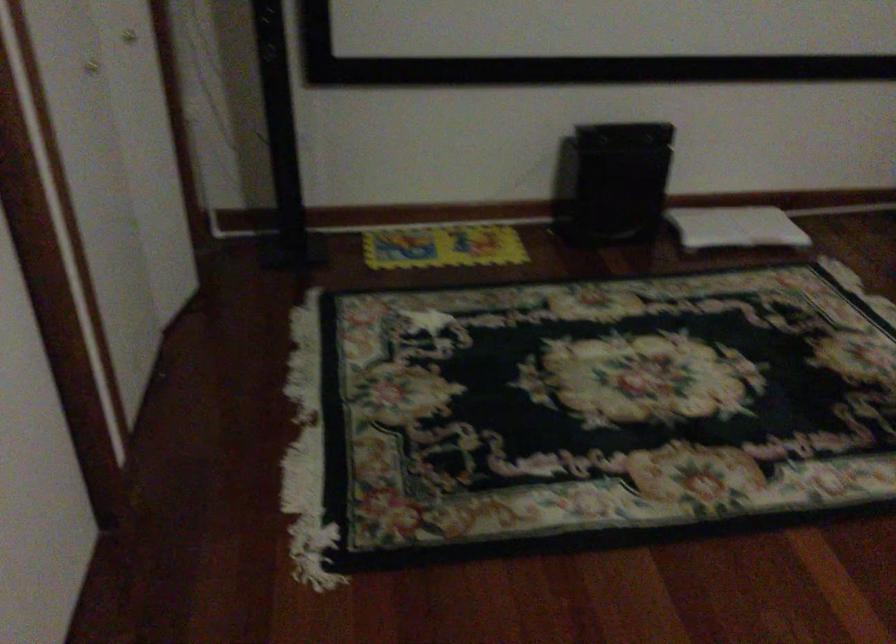
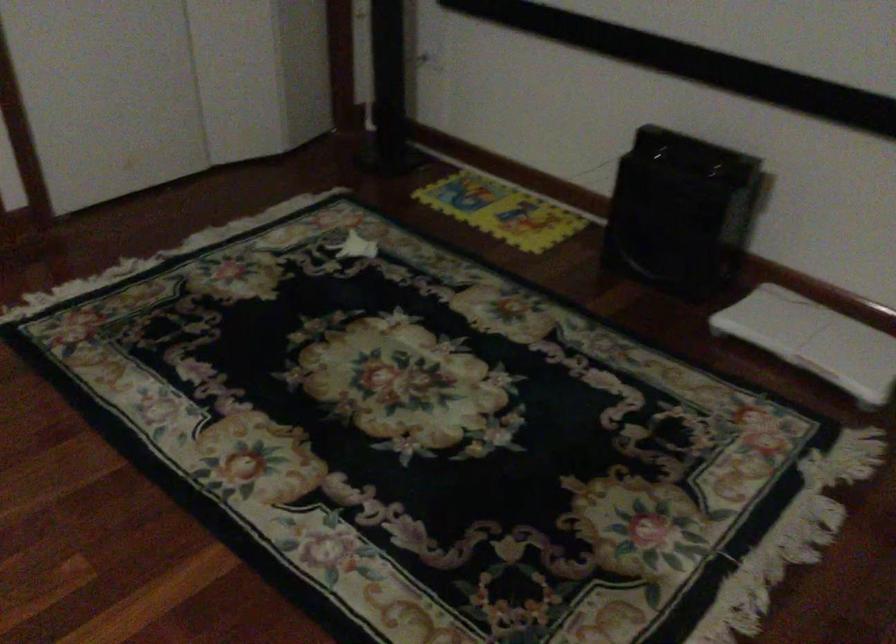
In the second image, find the point that corresponds to [759,218] in the first image.

(814, 339)